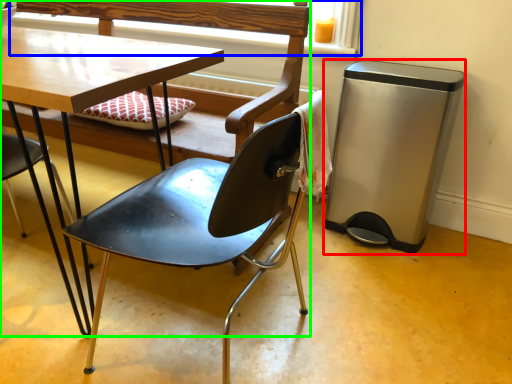
Question: Based on their relative distances, which object is nearer to trash bin/can (highlighted by a red box)? Choose from window frame (highlighted by a blue box) and chair (highlighted by a green box).

Choices:
 (A) window frame
 (B) chair

Answer: (A)